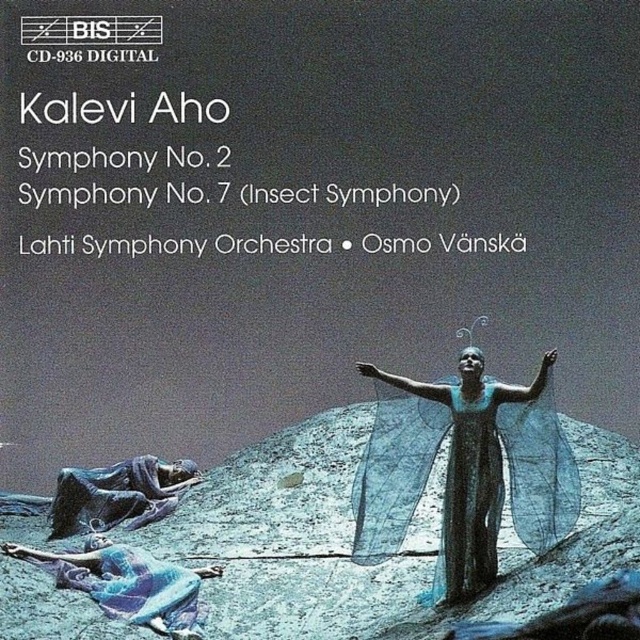
You are a graphic designer reviewing this album cover. You need to place a new text box for the conductor name. The text box must be placed to the right of the blue fabric at lower left. Where should you position it?

The blue fabric at lower left is located at point (129, 582). To place the text box to the right, position it at a coordinate with an x value greater than 0.912 and the same y value of 0.202.

You are an art curator examining the album cover. You need to determine the spatial relationship between the translucent blue gown at center and the matte black figure at lower left. Which object is positioned closer to the viewer?

The translucent blue gown at center is closer to the viewer than the matte black figure at lower left.